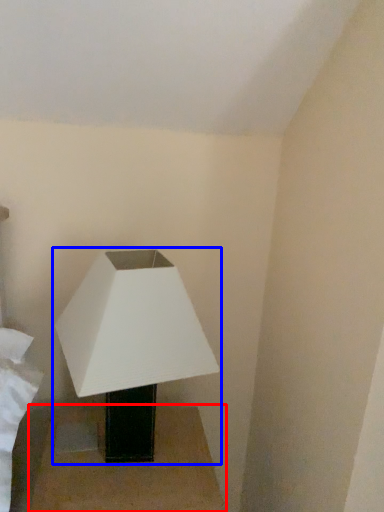
Question: Which object appears farthest to the camera in this image, table (highlighted by a red box) or lamp (highlighted by a blue box)?

Choices:
 (A) table
 (B) lamp

Answer: (A)